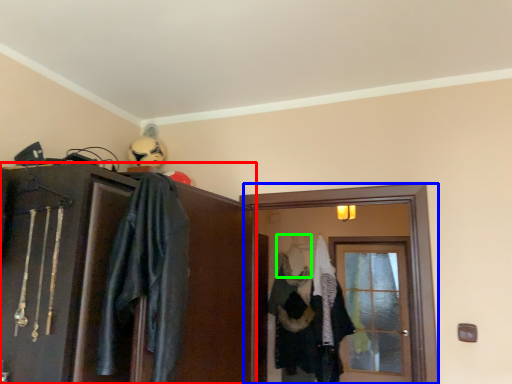
Question: Based on their relative distances, which object is nearer to cabinetry (highlighted by a red box)? Choose from screen door (highlighted by a blue box) and hanger (highlighted by a green box).

Choices:
 (A) screen door
 (B) hanger

Answer: (A)